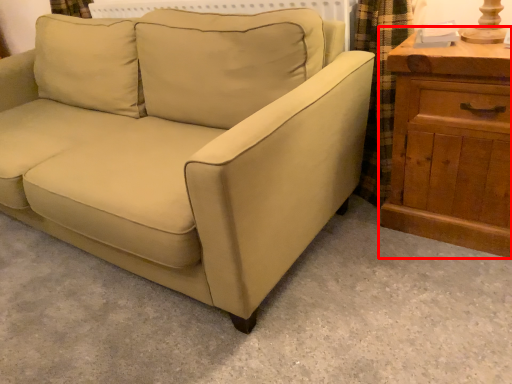
Question: From the image's perspective, where is chest of drawers (annotated by the red box) located relative to studio couch?

Choices:
 (A) below
 (B) above

Answer: (A)